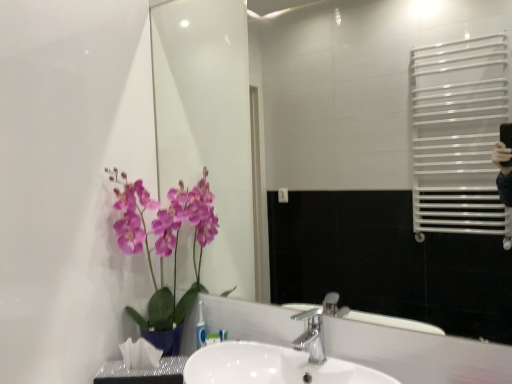
Question: In terms of width, does white glossy sink at center look wider or thinner when compared to transparent glass mirror at upper center?

Choices:
 (A) wide
 (B) thin

Answer: (A)

Question: Is point (315, 329) closer or farther from the camera than point (245, 273)?

Choices:
 (A) farther
 (B) closer

Answer: (B)

Question: Based on their relative distances, which object is farther from the purple silk orchid at left?

Choices:
 (A) white glossy sink at center
 (B) transparent glass mirror at upper center
 (C) silver metallic faucet at center

Answer: (B)

Question: Which of these objects is positioned farthest from the transparent glass mirror at upper center?

Choices:
 (A) white glossy sink at center
 (B) silver metallic faucet at center
 (C) purple silk orchid at left

Answer: (A)